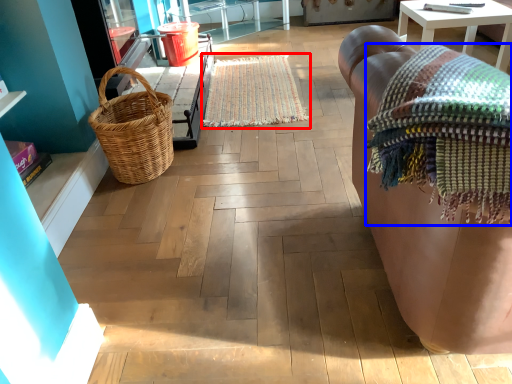
Question: Which object appears farthest to the camera in this image, mat (highlighted by a red box) or blanket (highlighted by a blue box)?

Choices:
 (A) mat
 (B) blanket

Answer: (A)